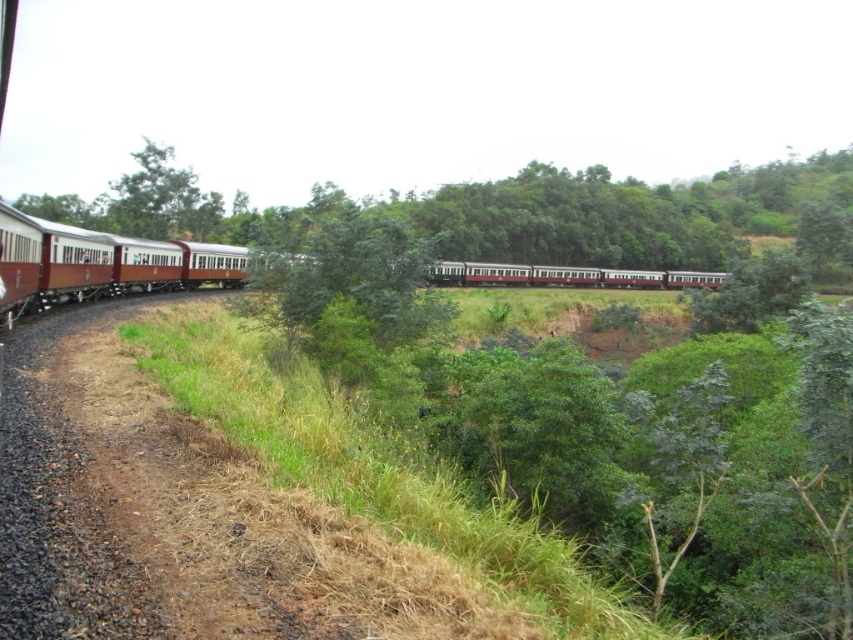
From the picture: You are standing at the point marked by coordinates (566,275) in the image. What object is exactly at this location?

The matte red train at center is located at point (566,275).

You are standing at the edge of the gravel track and see the matte red train at center and the green leafy tree at upper left. Which object is positioned more to the left in the image?

The green leafy tree at upper left is positioned more to the left than the matte red train at center according to the description.